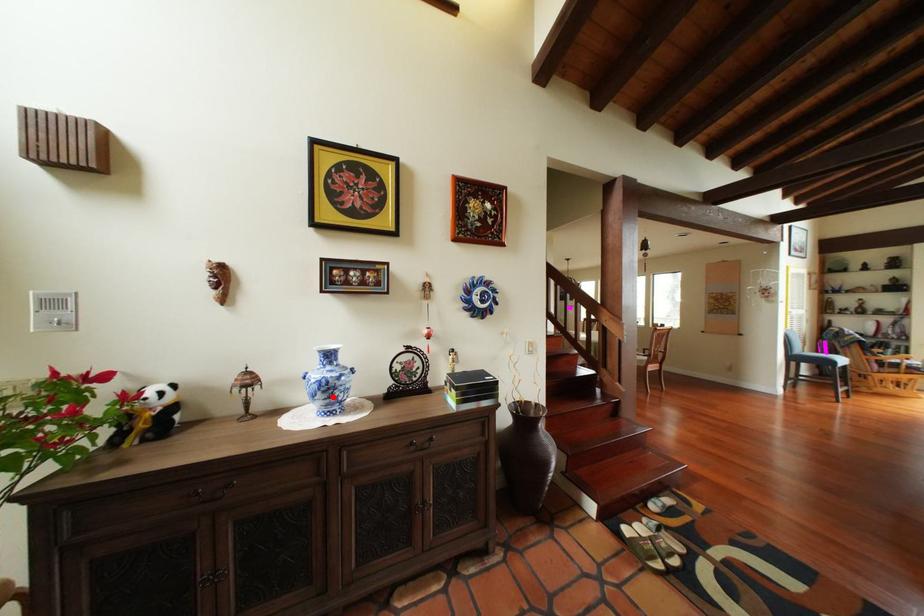
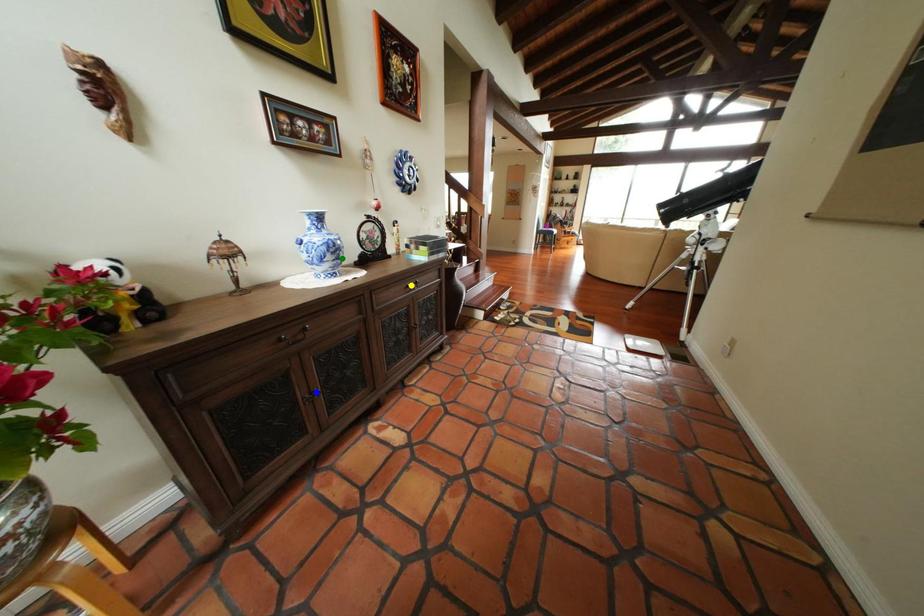
Question: I am providing you with two images of the same scene from different viewpoints. A red point is marked on the first image. You are given multiple points on the second image. Can you choose the point in image 2 that corresponds to the point in image 1?

Choices:
 (A) green point
 (B) blue point
 (C) yellow point

Answer: (A)